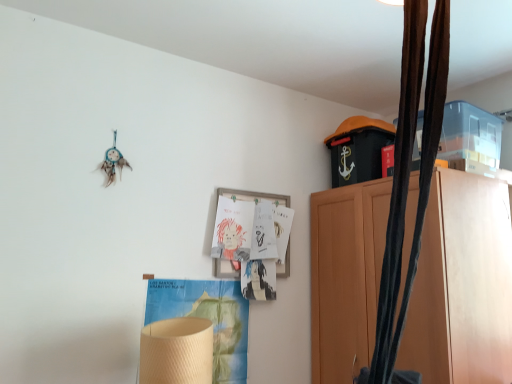
Question: Which is correct: wooden picture frame at center is inside wooden cabinet at upper right, or outside of it?

Choices:
 (A) inside
 (B) outside

Answer: (B)

Question: Looking at their shapes, would you say wooden picture frame at center is wider or thinner than wooden cabinet at upper right?

Choices:
 (A) thin
 (B) wide

Answer: (A)

Question: Considering the positions of wooden picture frame at center and wooden cabinet at upper right in the image, is wooden picture frame at center taller or shorter than wooden cabinet at upper right?

Choices:
 (A) short
 (B) tall

Answer: (A)

Question: Is wooden cabinet at upper right in front of or behind wooden picture frame at center in the image?

Choices:
 (A) behind
 (B) front

Answer: (B)

Question: Does point (509, 233) appear closer or farther from the camera than point (282, 273)?

Choices:
 (A) farther
 (B) closer

Answer: (B)

Question: Considering the relative positions of wooden cabinet at upper right and wooden picture frame at center in the image provided, is wooden cabinet at upper right to the left or to the right of wooden picture frame at center?

Choices:
 (A) right
 (B) left

Answer: (A)

Question: From the image's perspective, relative to wooden picture frame at center, is wooden cabinet at upper right above or below?

Choices:
 (A) above
 (B) below

Answer: (B)